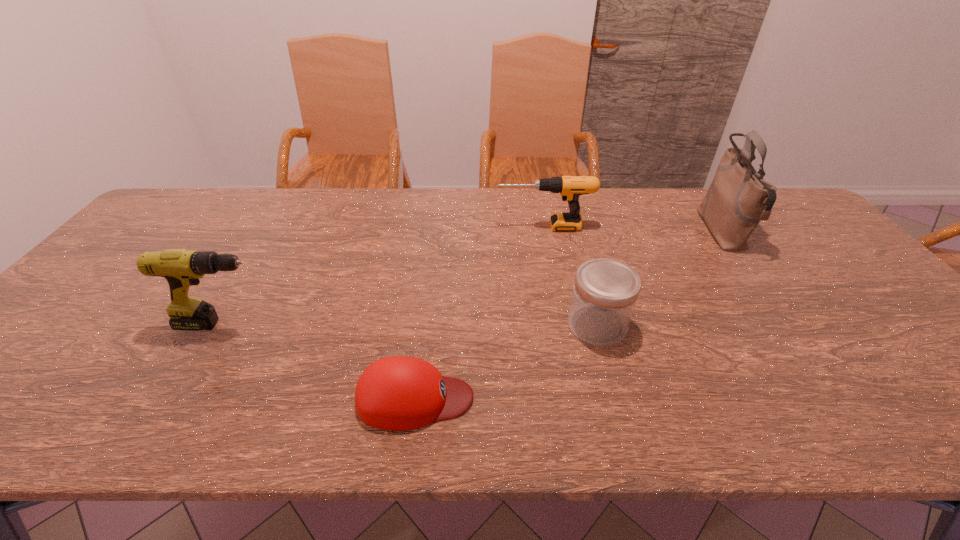
Find the location of `blank space located on the front-facing side of the tallest object`. blank space located on the front-facing side of the tallest object is located at coordinates (622, 232).

The width and height of the screenshot is (960, 540). In order to click on free region located 0.340m on the front-facing side of the tallest object in this screenshot , I will do `click(593, 232)`.

Find the location of a particular element. This screenshot has height=540, width=960. free point located 0.210m on the handle side of the leftmost object is located at coordinates (356, 324).

Locate an element on the screen. Image resolution: width=960 pixels, height=540 pixels. vacant space situated 0.240m on the handle side of the shorter drill is located at coordinates (420, 227).

The height and width of the screenshot is (540, 960). Identify the location of vacant space located 0.090m on the handle side of the shorter drill. (468, 227).

This screenshot has width=960, height=540. I want to click on free space located 0.290m on the handle side of the shorter drill, so click(405, 227).

Where is `vacant space located 0.180m on the back of the fourth tallest object`? The height and width of the screenshot is (540, 960). vacant space located 0.180m on the back of the fourth tallest object is located at coordinates (580, 260).

You are a GUI agent. You are given a task and a screenshot of the screen. Output one action in this format:
    pyautogui.click(x=<x>, y=<y>)
    Task: Click on the vacant space situated 0.230m on the front-facing side of the nearest object
    This screenshot has width=960, height=540.
    Given the screenshot: What is the action you would take?
    pyautogui.click(x=585, y=399)

Image resolution: width=960 pixels, height=540 pixels. Find the location of `shoulder bag located in the far edge section of the desktop`. shoulder bag located in the far edge section of the desktop is located at coordinates (738, 198).

This screenshot has width=960, height=540. Find the location of `drill at the far edge`. drill at the far edge is located at coordinates (570, 188).